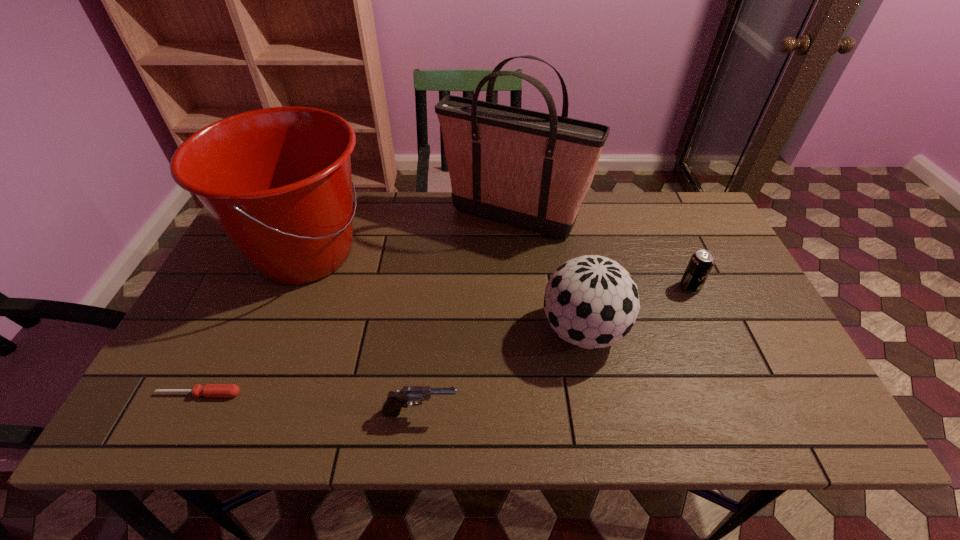
In order to click on the tallest object in this screenshot , I will do (532, 170).

The width and height of the screenshot is (960, 540). In order to click on bucket in this screenshot , I will do `click(278, 182)`.

Identify the location of the fourth shortest object. (591, 301).

You are a GUI agent. You are given a task and a screenshot of the screen. Output one action in this format:
    pyautogui.click(x=<x>, y=<y>)
    Task: Click on the soda can
    The width and height of the screenshot is (960, 540).
    Given the screenshot: What is the action you would take?
    pyautogui.click(x=701, y=263)

Find the location of a particular element. Image resolution: width=960 pixels, height=540 pixels. pistol is located at coordinates (395, 401).

Where is `the fifth farthest object`? the fifth farthest object is located at coordinates (210, 390).

Image resolution: width=960 pixels, height=540 pixels. I want to click on screwdriver, so click(x=210, y=390).

The image size is (960, 540). In order to click on free spot located 0.120m on the front of the shopping bag in this screenshot , I will do `click(517, 274)`.

Image resolution: width=960 pixels, height=540 pixels. What are the coordinates of `free space located 0.170m with the handle attached to the rim of the bucket` in the screenshot? It's located at (x=436, y=254).

At what (x,y) coordinates should I click in order to perform the action: click on vacant space located on the right of the fourth shortest object. Please return your answer as a coordinate pair (x, y). The width and height of the screenshot is (960, 540). Looking at the image, I should click on (703, 330).